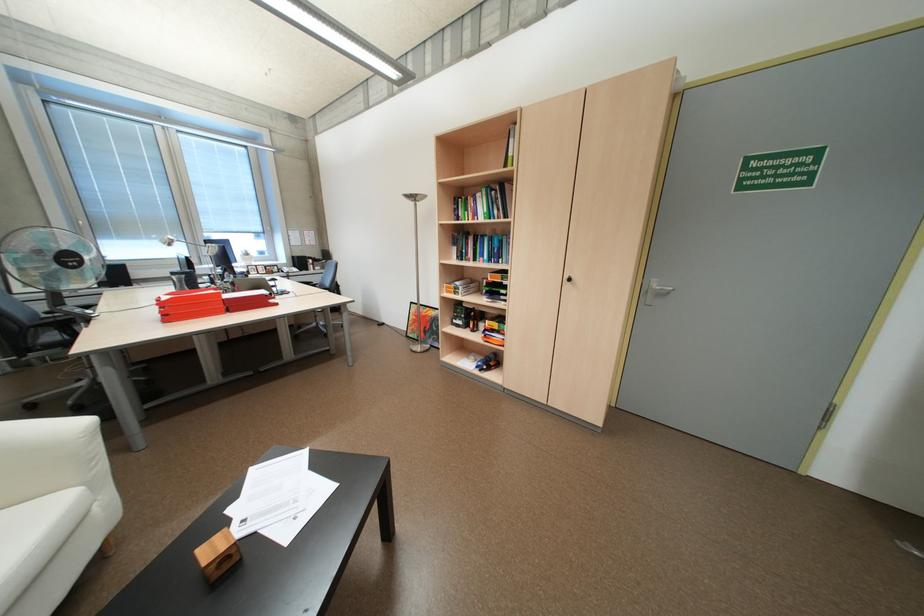
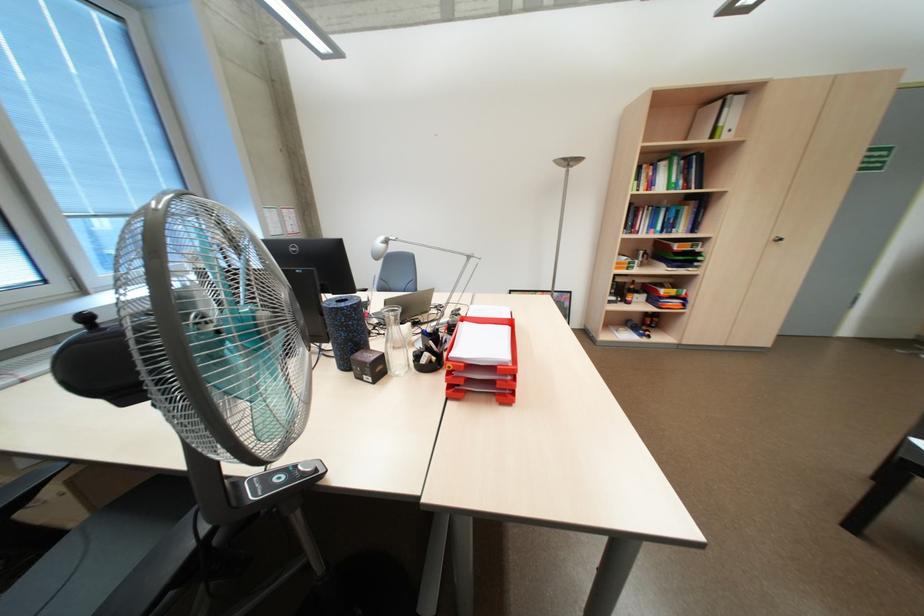
Find the pixel in the second image that matches pixel 505 325 in the first image.

(683, 291)